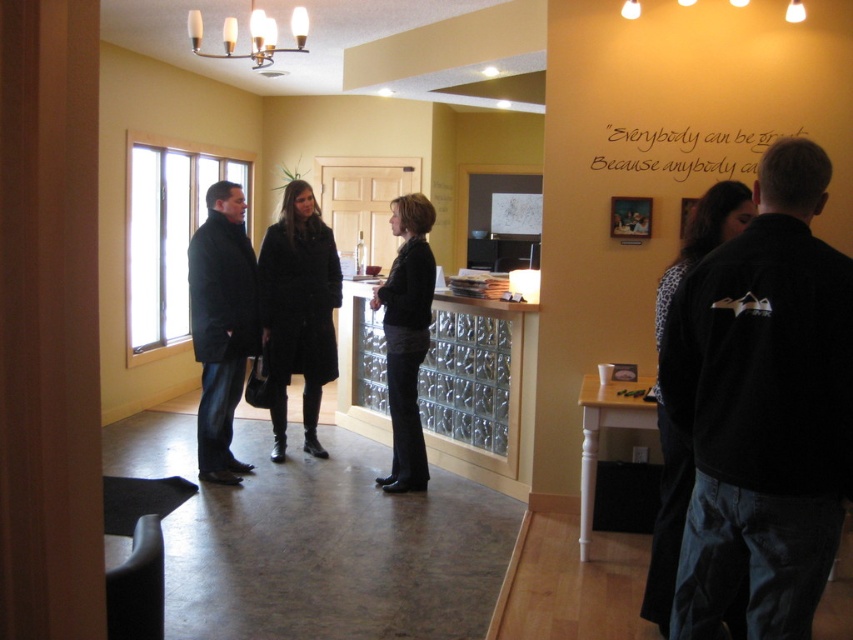
Question: Which point appears farthest from the camera in this image?

Choices:
 (A) (763, 244)
 (B) (405, 308)

Answer: (B)

Question: Is black wool coat at center to the right of dark gray sweater at center from the viewer's perspective?

Choices:
 (A) yes
 (B) no

Answer: (B)

Question: Estimate the real-world distances between objects in this image. Which object is farther from the black fleece jacket at right?

Choices:
 (A) dark gray sweater at center
 (B) dark gray coat at left
 (C) black wool coat at center

Answer: (C)

Question: Can you confirm if black wool coat at center is positioned below dark gray sweater at center?

Choices:
 (A) yes
 (B) no

Answer: (B)

Question: Estimate the real-world distances between objects in this image. Which object is closer to the dark gray coat at left?

Choices:
 (A) black fleece jacket at right
 (B) black wool coat at center
 (C) dark gray sweater at center

Answer: (B)

Question: From the image, what is the correct spatial relationship of dark gray coat at left in relation to dark gray sweater at center?

Choices:
 (A) left
 (B) right

Answer: (A)